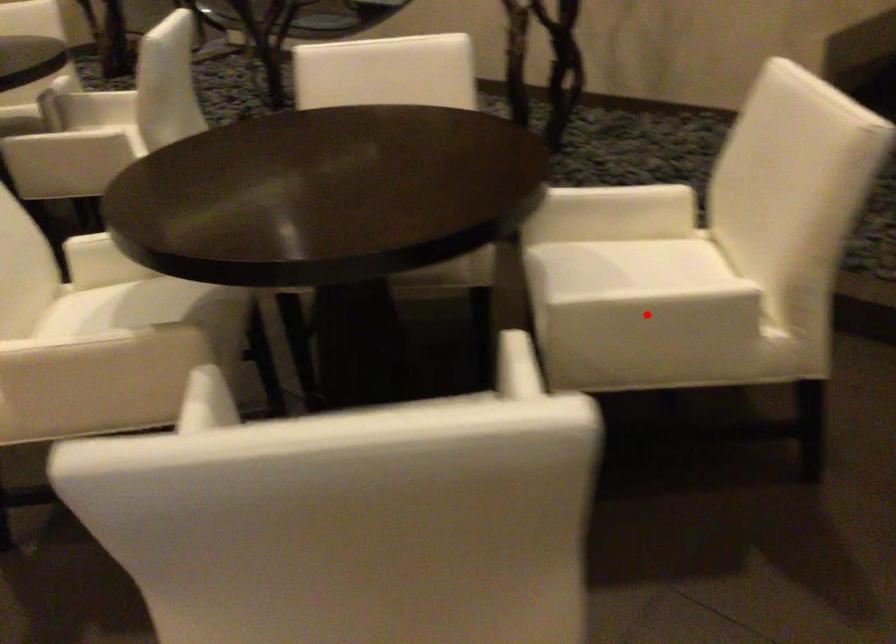
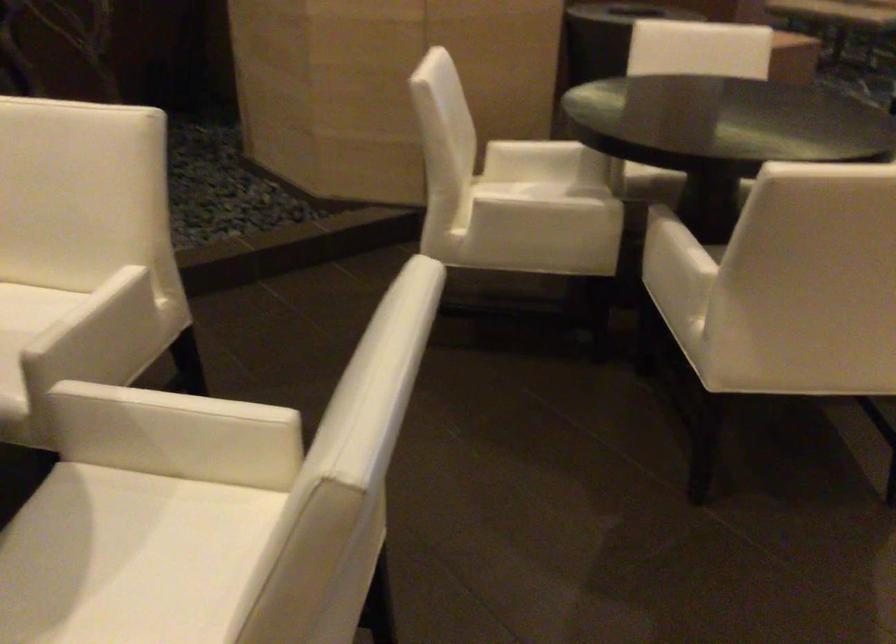
The point at the highlighted location is marked in the first image. Where is the corresponding point in the second image?

(102, 328)